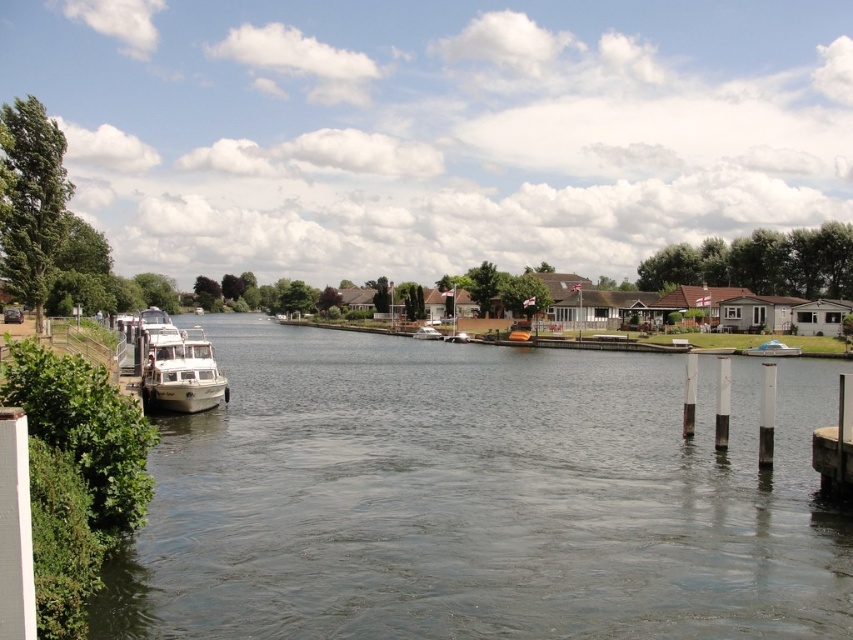
Between point (372, 582) and point (215, 403), which one is positioned in front?

Positioned in front is point (372, 582).

Can you confirm if clear water at left is bigger than white glossy boat at left?

Yes, clear water at left is bigger than white glossy boat at left.

At what (x,y) coordinates should I click in order to perform the action: click on clear water at left. Please return your answer as a coordinate pair (x, y). This screenshot has width=853, height=640. Looking at the image, I should click on (479, 499).

Does blue glossy car at center have a smaller size compared to white glossy boat at center?

Yes.

Between blue glossy car at center and white glossy boat at center, which one is positioned lower?

blue glossy car at center is below.

Does point (758, 346) come closer to viewer compared to point (421, 337)?

Yes, it is.

At what (x,y) coordinates should I click in order to perform the action: click on blue glossy car at center. Please return your answer as a coordinate pair (x, y). The width and height of the screenshot is (853, 640). Looking at the image, I should click on (772, 349).

Is clear water at left further to the viewer compared to blue glossy car at center?

No, it is in front of blue glossy car at center.

Between point (459, 410) and point (775, 342), which one is positioned behind?

Point (775, 342)

Who is more distant from viewer, (363, 470) or (763, 340)?

The point (763, 340) is behind.

Find the location of a particular element. This screenshot has height=640, width=853. clear water at left is located at coordinates (479, 499).